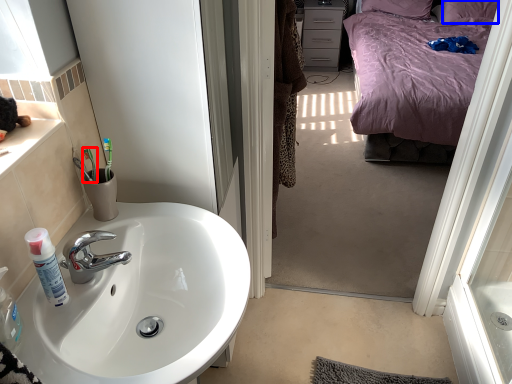
Question: Which point is closer to the camera, toothbrush (highlighted by a red box) or pillow (highlighted by a blue box)?

Choices:
 (A) toothbrush
 (B) pillow

Answer: (A)